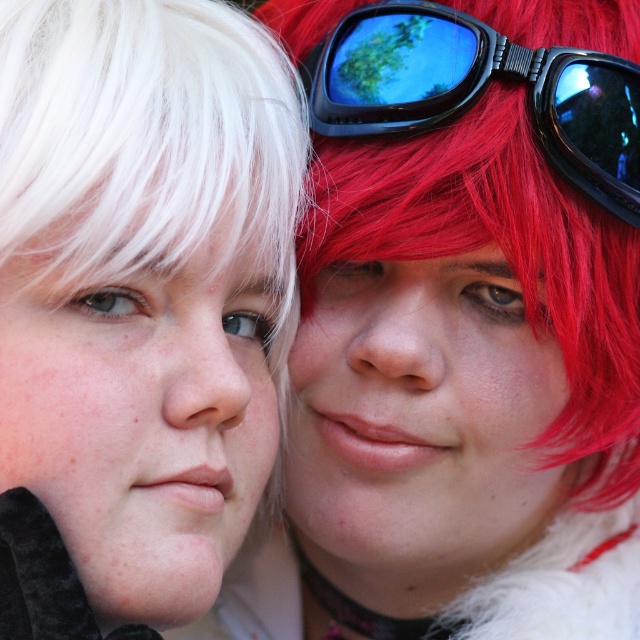
Looking at this image, can you confirm if shiny red wig at center is wider than black glossy goggles at upper right?

Yes.

Does point (552, 273) come farther from viewer compared to point (572, 77)?

No, it is not.

Where is `shiny red wig at center`? The width and height of the screenshot is (640, 640). shiny red wig at center is located at coordinates (458, 332).

Is shiny red wig at center to the left of white matte wig at left from the viewer's perspective?

No, shiny red wig at center is not to the left of white matte wig at left.

Is point (365, 358) closer to viewer compared to point (20, 488)?

No, it is behind (20, 488).

Is point (595, 608) more distant than point (220, 108)?

That is True.

What are the coordinates of `shiny red wig at center` in the screenshot? It's located at (458, 332).

Is white matte wig at left wider than black glossy goggles at upper right?

Incorrect, white matte wig at left's width does not surpass black glossy goggles at upper right's.

Between white matte wig at left and black glossy goggles at upper right, which one has less height?

Standing shorter between the two is black glossy goggles at upper right.

Which is behind, point (152, 221) or point (589, 176)?

Positioned behind is point (589, 176).

At what (x,y) coordinates should I click in order to perform the action: click on white matte wig at left. Please return your answer as a coordinate pair (x, y). The height and width of the screenshot is (640, 640). Looking at the image, I should click on (138, 305).